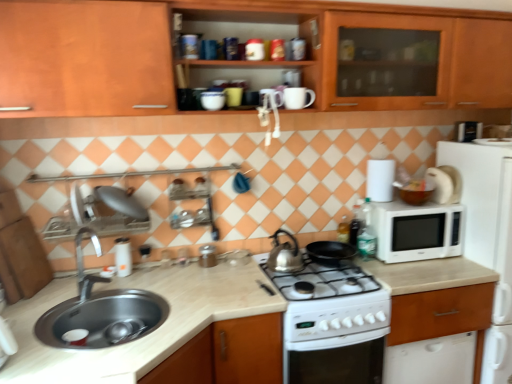
Identify the location of vacant region above wooden cabinet at right, which is the 1th cabinetry from bottom to top (from a real-world perspective). The height and width of the screenshot is (384, 512). (423, 262).